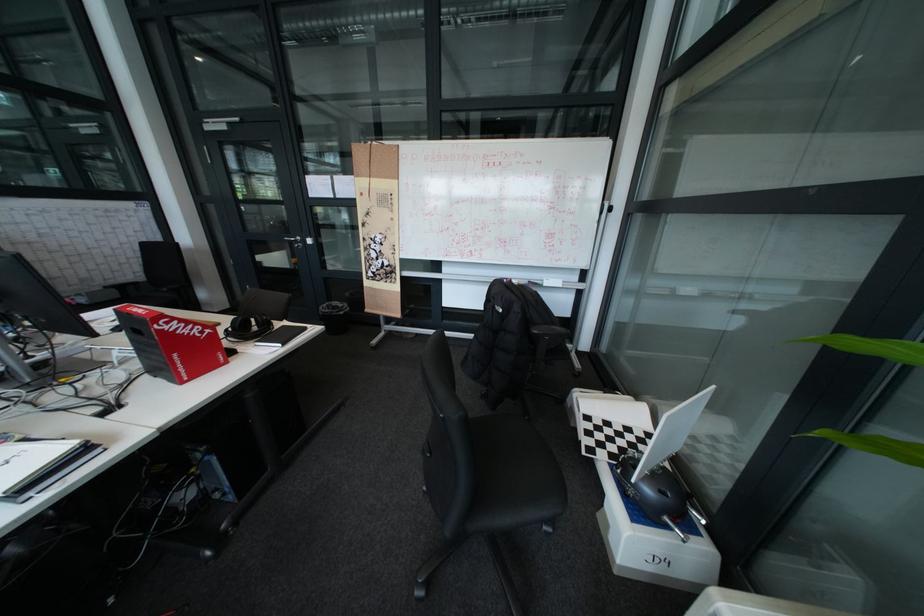
Which object does [334,317] point to?

This point indicates the black trash bin.